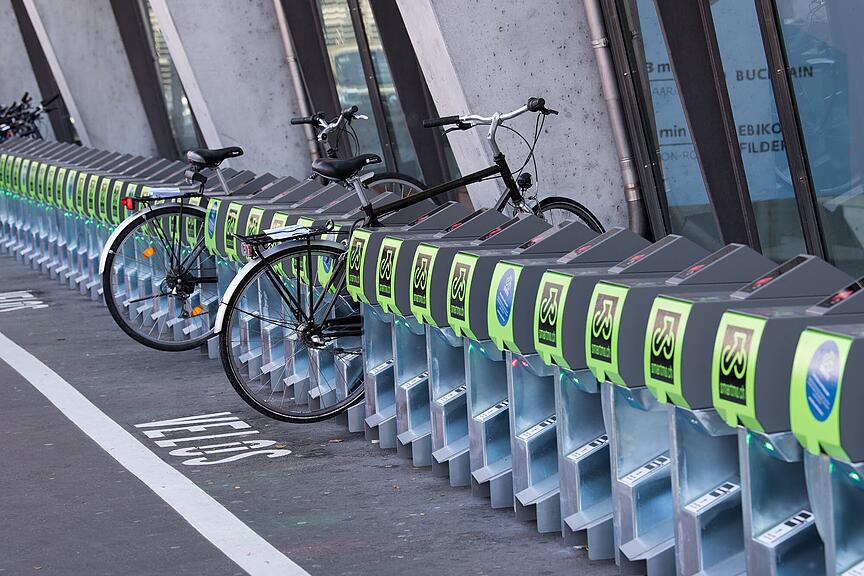
At what (x,y) coordinates should I click in order to perform the action: click on window. Please return your answer as a coordinate pair (x, y). This screenshot has width=864, height=576. Looking at the image, I should click on (803, 79), (756, 98), (665, 107), (385, 87), (357, 79), (172, 87).